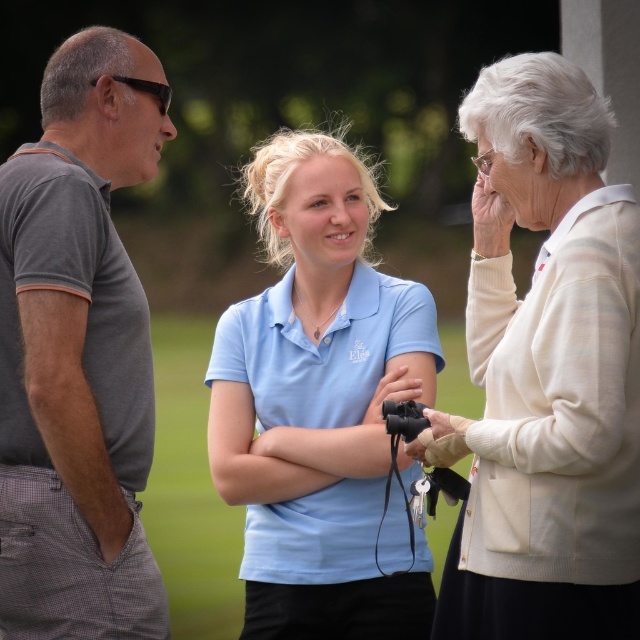
Based on the scene description, where is the matte blue shirt at center located in the image?

The matte blue shirt at center is located at point 2D coordinates of (321, 404).

You are a photographer adjusting the camera settings to ensure both the white knit cardigan at upper right and the matte blue shirt at center are in focus. Based on their heights, which one might require you to adjust the focus closer to the camera?

The white knit cardigan at upper right is not as tall as the matte blue shirt at center, so it is closer to the camera. Therefore, adjusting focus closer to the camera would help ensure both are in focus.

You are a photographer trying to capture a group photo of the matte blue shirt at center and the gray cotton polo shirt at left. To ensure both are in frame, should you adjust your camera to focus more to the left or the right?

The matte blue shirt at center is positioned on the right side of gray cotton polo shirt at left, so focusing more to the right would keep both in frame.